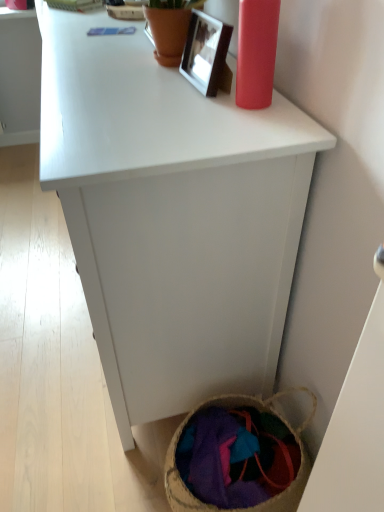
The height and width of the screenshot is (512, 384). What do you see at coordinates (260, 411) in the screenshot?
I see `textured woven basket at lower right` at bounding box center [260, 411].

Identify the location of metallic silver picture frame at upper center. This screenshot has width=384, height=512. (207, 54).

Where is `white matte cabinet at center`? This screenshot has width=384, height=512. white matte cabinet at center is located at coordinates (172, 217).

Is textured woven basket at lower right completely or partially inside metallic silver picture frame at upper center?

No, textured woven basket at lower right is not surrounded by metallic silver picture frame at upper center.

From a real-world perspective, which is physically above, metallic silver picture frame at upper center or textured woven basket at lower right?

From a 3D spatial view, metallic silver picture frame at upper center is above.

In the image, is metallic silver picture frame at upper center positioned in front of or behind textured woven basket at lower right?

metallic silver picture frame at upper center is positioned closer to the viewer than textured woven basket at lower right.

Considering the relative sizes of metallic silver picture frame at upper center and textured woven basket at lower right in the image provided, is metallic silver picture frame at upper center wider than textured woven basket at lower right?

No.

Which object is positioned more to the right, textured woven basket at lower right or metallic silver picture frame at upper center?

Positioned to the right is textured woven basket at lower right.

Is textured woven basket at lower right oriented away from metallic silver picture frame at upper center?

No, textured woven basket at lower right is not facing away from metallic silver picture frame at upper center.

What are the coordinates of `picture frame that appears on the left of textured woven basket at lower right` in the screenshot? It's located at (207, 54).

Does textured woven basket at lower right have a greater width compared to metallic silver picture frame at upper center?

Yes.

Considering the sizes of objects white matte cabinet at center and metallic silver picture frame at upper center in the image provided, who is taller, white matte cabinet at center or metallic silver picture frame at upper center?

white matte cabinet at center.

Consider the image. Visually, is white matte cabinet at center positioned to the left or to the right of metallic silver picture frame at upper center?

white matte cabinet at center is to the left of metallic silver picture frame at upper center.

In the scene shown: From a real-world perspective, is white matte cabinet at center under metallic silver picture frame at upper center?

Indeed, from a real-world perspective, white matte cabinet at center is positioned beneath metallic silver picture frame at upper center.

From the image's perspective, is white matte cabinet at center under metallic silver picture frame at upper center?

Yes.

Considering the relative positions of textured woven basket at lower right and white matte cabinet at center in the image provided, is textured woven basket at lower right to the left or to the right of white matte cabinet at center?

textured woven basket at lower right is positioned on white matte cabinet at center's right side.

Is textured woven basket at lower right positioned with its back to white matte cabinet at center?

No, textured woven basket at lower right is not facing away from white matte cabinet at center.

From the image's perspective, does textured woven basket at lower right appear higher than white matte cabinet at center?

Incorrect, from the image's perspective, textured woven basket at lower right is lower than white matte cabinet at center.

Looking at their sizes, would you say textured woven basket at lower right is wider or thinner than white matte cabinet at center?

Clearly, textured woven basket at lower right has less width compared to white matte cabinet at center.

Which is behind, point (292, 238) or point (293, 492)?

Positioned behind is point (293, 492).

Is white matte cabinet at center aimed at textured woven basket at lower right?

No, white matte cabinet at center is not facing towards textured woven basket at lower right.

Consider the image. From a real-world perspective, relative to textured woven basket at lower right, is white matte cabinet at center vertically above or below?

Clearly, from a real-world perspective, white matte cabinet at center is above textured woven basket at lower right.

Identify the location of desk located in front of the textured woven basket at lower right. (172, 217).

Does metallic silver picture frame at upper center appear on the left side of white matte cabinet at center?

No.

Is point (204, 67) closer to viewer compared to point (129, 189)?

No, it is behind (129, 189).

Can you confirm if metallic silver picture frame at upper center is wider than white matte cabinet at center?

No, metallic silver picture frame at upper center is not wider than white matte cabinet at center.

This screenshot has width=384, height=512. I want to click on basket that appears on the right of metallic silver picture frame at upper center, so (260, 411).

Find the location of a particular element. basket behind the metallic silver picture frame at upper center is located at coordinates (260, 411).

Looking at this image, looking at the image, which one is located closer to white matte cabinet at center, metallic silver picture frame at upper center or textured woven basket at lower right?

Among the two, metallic silver picture frame at upper center is located nearer to white matte cabinet at center.

Which object lies further to the anchor point white matte cabinet at center, textured woven basket at lower right or metallic silver picture frame at upper center?

textured woven basket at lower right.

Considering their positions, is white matte cabinet at center positioned closer to metallic silver picture frame at upper center than textured woven basket at lower right?

white matte cabinet at center.

Which object lies nearer to the anchor point textured woven basket at lower right, white matte cabinet at center or metallic silver picture frame at upper center?

white matte cabinet at center is closer to textured woven basket at lower right.

Looking at the image, which one is located closer to textured woven basket at lower right, metallic silver picture frame at upper center or white matte cabinet at center?

Based on the image, white matte cabinet at center appears to be nearer to textured woven basket at lower right.

When comparing their distances from metallic silver picture frame at upper center, does textured woven basket at lower right or white matte cabinet at center seem closer?

Based on the image, white matte cabinet at center appears to be nearer to metallic silver picture frame at upper center.

Find the location of a particular element. The image size is (384, 512). desk between metallic silver picture frame at upper center and textured woven basket at lower right from top to bottom is located at coordinates (172, 217).